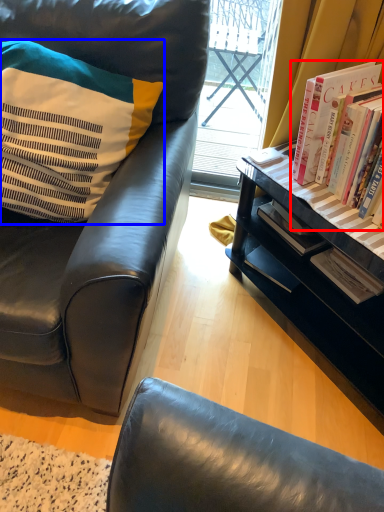
Question: Among these objects, which one is farthest to the camera, book (highlighted by a red box) or pillow (highlighted by a blue box)?

Choices:
 (A) book
 (B) pillow

Answer: (A)